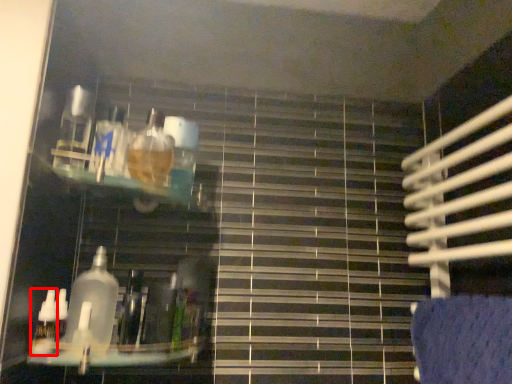
Question: Considering the relative positions of bottle (annotated by the red box) and bottle in the image provided, where is bottle (annotated by the red box) located with respect to the staircase?

Choices:
 (A) right
 (B) left

Answer: (B)